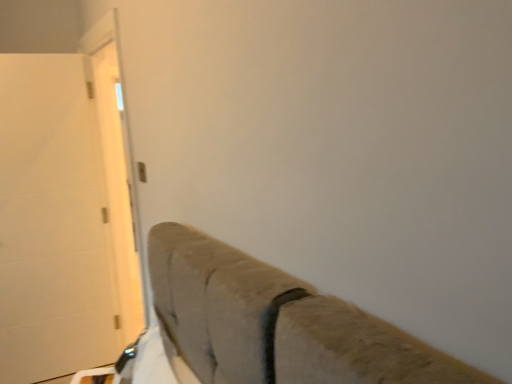
This screenshot has width=512, height=384. I want to click on transparent glass door at left, so click(118, 186).

What do you see at coordinates (118, 186) in the screenshot? The height and width of the screenshot is (384, 512). I see `transparent glass door at left` at bounding box center [118, 186].

This screenshot has width=512, height=384. I want to click on transparent glass door at left, so click(x=118, y=186).